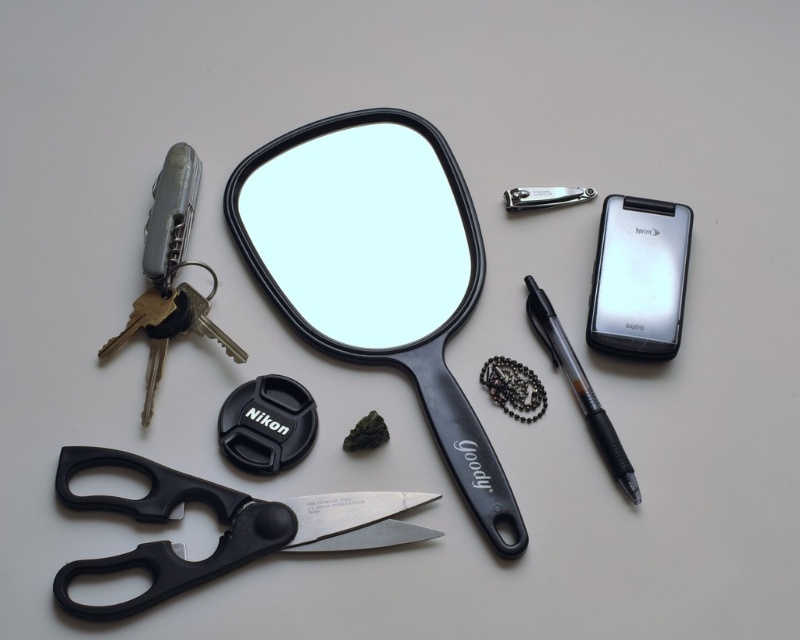
Question: Estimate the real-world distances between objects in this image. Which object is farther from the silver metallic multi-tool at left?

Choices:
 (A) black plastic view mirror at center
 (B) black matte pen at right
 (C) black plastic lens cap at center

Answer: (B)

Question: Observing the image, what is the correct spatial positioning of black plastic lens cap at center in reference to black matte pen at right?

Choices:
 (A) left
 (B) right

Answer: (A)

Question: Is black plastic view mirror at center thinner than silver metallic multi-tool at left?

Choices:
 (A) no
 (B) yes

Answer: (A)

Question: Which of these objects is positioned farthest from the black plastic scissors at lower left?

Choices:
 (A) black matte pen at right
 (B) black plastic lens cap at center

Answer: (A)

Question: Which object is the farthest from the sleek silver phone at right?

Choices:
 (A) black plastic lens cap at center
 (B) black plastic mirror at center
 (C) black plastic scissors at lower left

Answer: (C)

Question: Does black plastic view mirror at center appear on the left side of black plastic mirror at center?

Choices:
 (A) no
 (B) yes

Answer: (A)